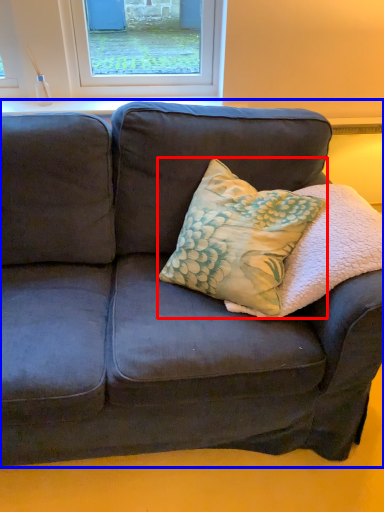
Question: Which point is further to the camera, throw pillow (highlighted by a red box) or studio couch (highlighted by a blue box)?

Choices:
 (A) throw pillow
 (B) studio couch

Answer: (B)